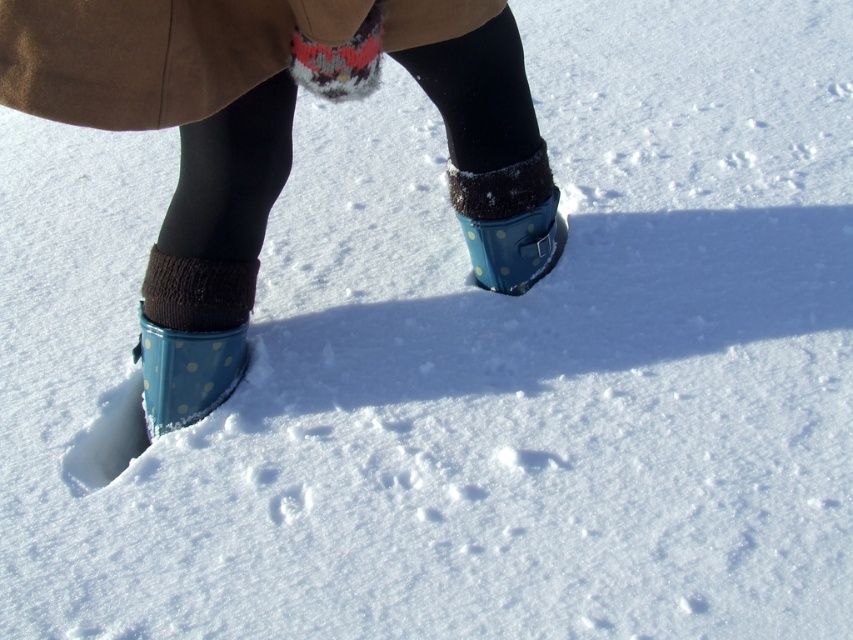
You are standing at the point marked as point [270,116] in the image. You want to throw a snowball to someone who is 2 meters away from you. Can you reach them with your throw?

The distance between you and the viewer is 1.52 meters. Since the target is 2 meters away, which is farther than 1.52 meters, you cannot reach them with your throw.

What are the coordinates of the blue polka dot rubber boot at center?

The blue polka dot rubber boot at center is located at coordinates point (509, 221).

You are trying to decide which of the two items, the blue polka dot rubber boots at center or the blue polka dot rubber boot at center, is the correct one to wear for a winter walk. Based on the scene description, which one is larger and more suitable for covering the foot properly?

The blue polka dot rubber boots at center is bigger than the blue polka dot rubber boot at center, making it the more suitable option for proper foot coverage during a winter walk.